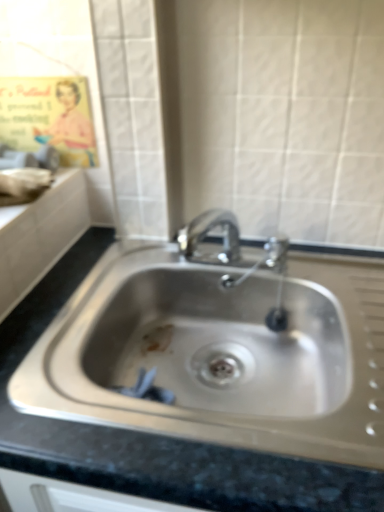
What do you see at coordinates (220, 354) in the screenshot? I see `stainless steel sink at center` at bounding box center [220, 354].

Identify the location of stainless steel sink at center. (220, 354).

Where is `stainless steel sink at center`? This screenshot has width=384, height=512. stainless steel sink at center is located at coordinates (220, 354).